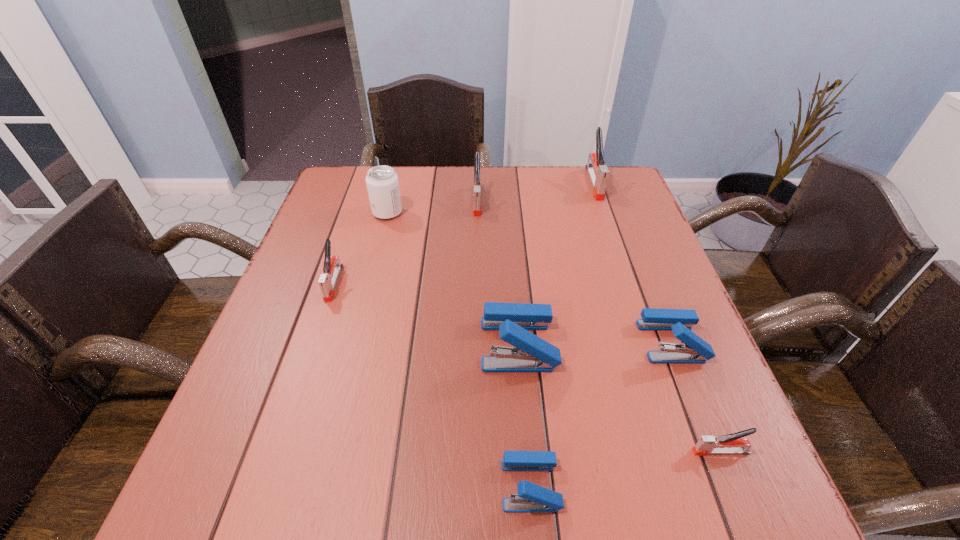
The width and height of the screenshot is (960, 540). What are the coordinates of `the tallest stapler` in the screenshot? It's located at (598, 173).

What are the coordinates of `the biggest gray stapler` in the screenshot? It's located at (598, 173).

The height and width of the screenshot is (540, 960). In order to click on the second biggest gray stapler in this screenshot , I will do `click(477, 210)`.

I want to click on soda can, so click(x=382, y=184).

Locate an element on the screen. The height and width of the screenshot is (540, 960). the biggest blue stapler is located at coordinates (530, 353).

This screenshot has height=540, width=960. What are the coordinates of `the fourth farthest object` in the screenshot? It's located at (327, 281).

You are a GUI agent. You are given a task and a screenshot of the screen. Output one action in this format:
    pyautogui.click(x=<x>, y=<y>)
    Task: Click on the leftmost gray stapler
    Image resolution: width=960 pixels, height=540 pixels.
    Given the screenshot: What is the action you would take?
    pyautogui.click(x=327, y=281)

This screenshot has width=960, height=540. In order to click on the rightmost blue stapler in this screenshot , I will do `click(695, 350)`.

I want to click on the smallest gray stapler, so click(x=732, y=443).

This screenshot has height=540, width=960. In order to click on the second nearest stapler in this screenshot , I will do `click(732, 443)`.